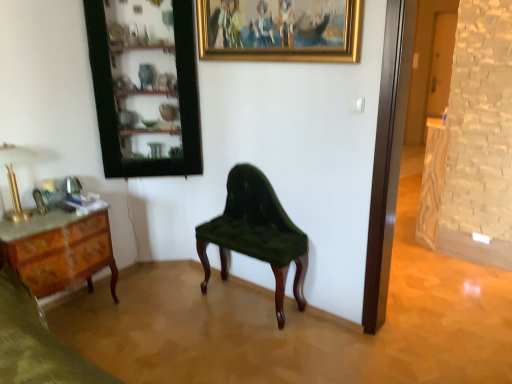
Find the location of a particular element. The width and height of the screenshot is (512, 384). free region under marble top wood desk at left (from a real-world perspective) is located at coordinates (84, 308).